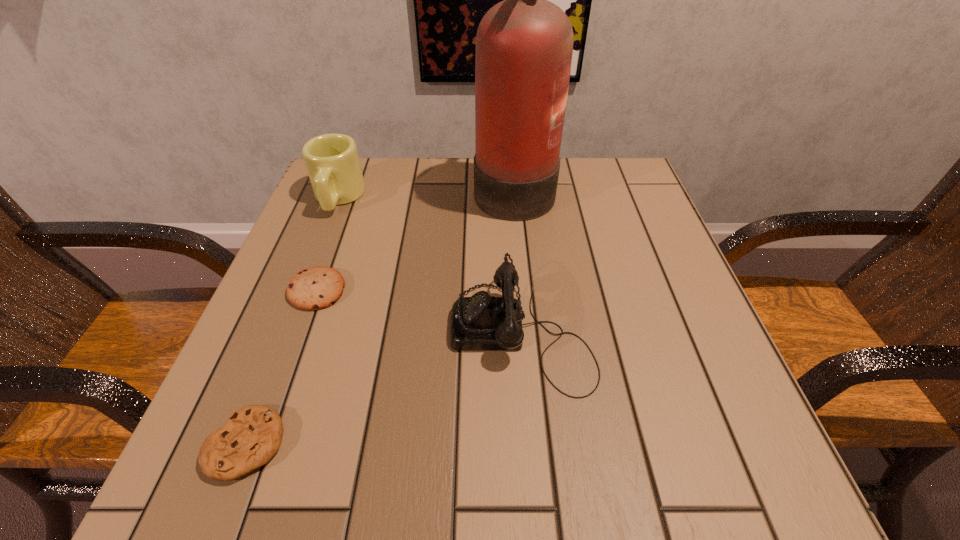
Find the location of a particular element. The image size is (960, 540). blank space at the far edge of the desktop is located at coordinates (467, 199).

Find the location of a particular element. The height and width of the screenshot is (540, 960). free spot at the left edge of the desktop is located at coordinates (244, 350).

The image size is (960, 540). Identify the location of free space at the right edge of the desktop. (674, 331).

You are a GUI agent. You are given a task and a screenshot of the screen. Output one action in this format:
    pyautogui.click(x=<x>, y=<y>)
    Task: Click on the vacant point located between the mug and the farther cookie
    This screenshot has width=960, height=540.
    Given the screenshot: What is the action you would take?
    pyautogui.click(x=327, y=244)

Where is `free space between the third tallest object and the fourth shortest object`? The width and height of the screenshot is (960, 540). free space between the third tallest object and the fourth shortest object is located at coordinates (429, 265).

Locate an element on the screen. Image resolution: width=960 pixels, height=540 pixels. empty space that is in between the telephone and the nearest object is located at coordinates (384, 388).

You are a GUI agent. You are given a task and a screenshot of the screen. Output one action in this format:
    pyautogui.click(x=<x>, y=<y>)
    Task: Click on the vacant area between the third tallest object and the farther cookie
    The width and height of the screenshot is (960, 540).
    Given the screenshot: What is the action you would take?
    pyautogui.click(x=419, y=310)

This screenshot has width=960, height=540. I want to click on vacant point located between the nearest object and the fire extinguisher, so click(380, 315).

Locate an element on the screen. The height and width of the screenshot is (540, 960). free area in between the tallest object and the second tallest object is located at coordinates (426, 192).

The height and width of the screenshot is (540, 960). Identify the location of vacant space that is in between the mug and the nearer cookie. (292, 321).